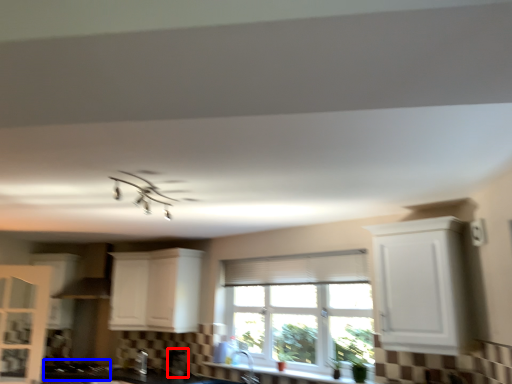
Question: Which of the following is the farthest to the observer, appliance (highlighted by a red box) or gas stove (highlighted by a blue box)?

Choices:
 (A) appliance
 (B) gas stove

Answer: (B)